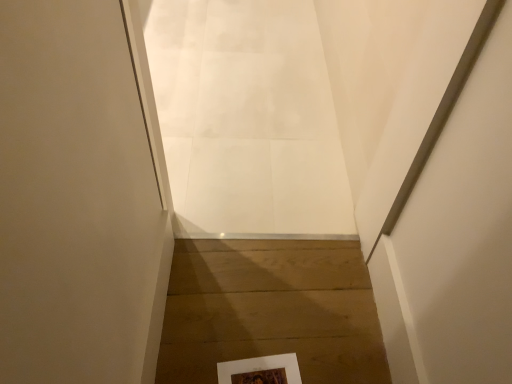
What do you see at coordinates (261, 370) in the screenshot?
I see `matte white picture frame at lower center` at bounding box center [261, 370].

Image resolution: width=512 pixels, height=384 pixels. I want to click on matte white picture frame at lower center, so click(261, 370).

Identify the location of matte white picture frame at lower center. The height and width of the screenshot is (384, 512). (261, 370).